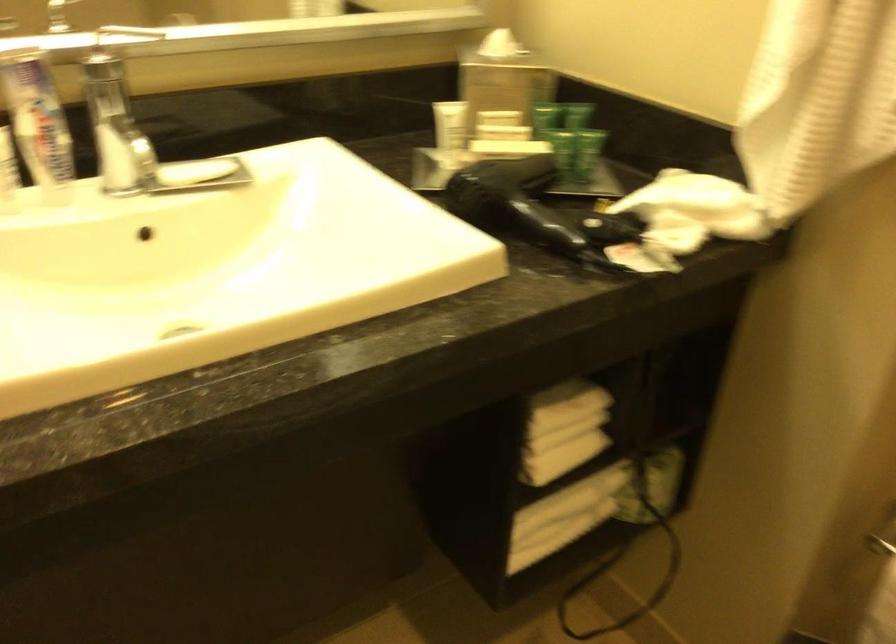
Find where to lift the white soap bar. Please return your answer as a coordinate pair (x, y).

(195, 171)